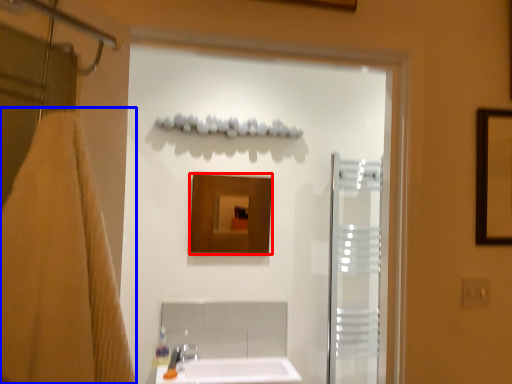
Question: Which object is further to the camera taking this photo, mirror (highlighted by a red box) or bath towel (highlighted by a blue box)?

Choices:
 (A) mirror
 (B) bath towel

Answer: (A)